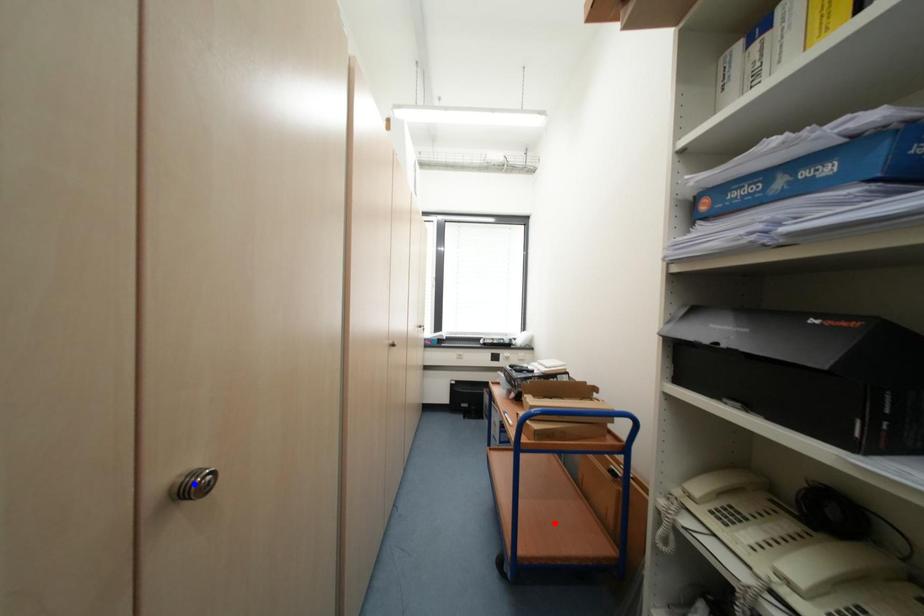
Question: Which of the two points in the image is closer to the camera?

Choices:
 (A) Blue point is closer.
 (B) Red point is closer.

Answer: (A)